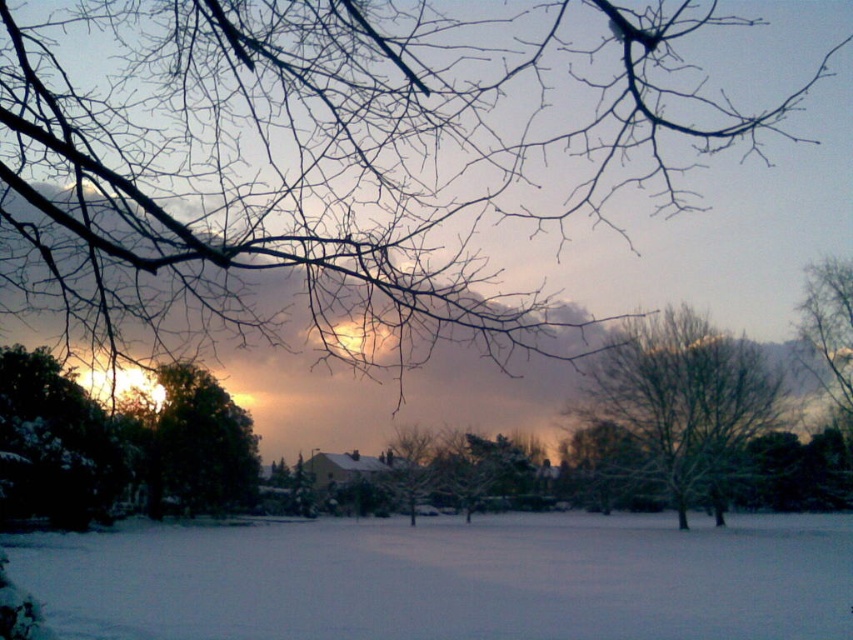
Can you confirm if bare branches at upper center is positioned above white powdery snow at center?

Correct, bare branches at upper center is located above white powdery snow at center.

This screenshot has height=640, width=853. What do you see at coordinates (331, 156) in the screenshot?
I see `bare branches at upper center` at bounding box center [331, 156].

The width and height of the screenshot is (853, 640). I want to click on bare branches at upper center, so click(331, 156).

How far apart are bare branches at upper center and snow-covered tree at center?

bare branches at upper center is 31.33 meters from snow-covered tree at center.

Can you confirm if bare branches at upper center is bigger than snow-covered tree at center?

No.

Is point (132, 147) behind point (732, 394)?

No, it is not.

Where is `bare branches at upper center`? Image resolution: width=853 pixels, height=640 pixels. bare branches at upper center is located at coordinates point(331,156).

Who is positioned more to the right, bare branches at upper center or bare branches at upper right?

bare branches at upper right is more to the right.

Does bare branches at upper center lie behind bare branches at upper right?

No, it is not.

Is point (262, 227) farther from camera compared to point (848, 358)?

That is False.

Where is `bare branches at upper center`? bare branches at upper center is located at coordinates (331, 156).